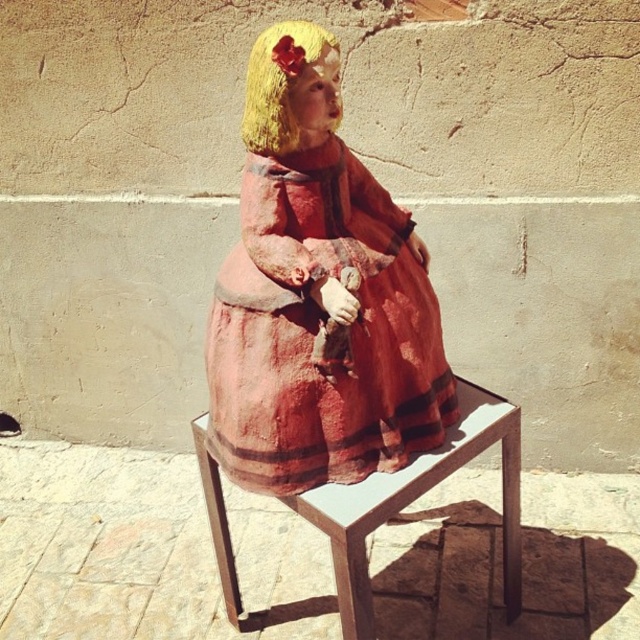
Can you confirm if matte red fabric dress at center is bigger than wooden stool at center?

No.

Who is taller, matte red fabric dress at center or wooden stool at center?

matte red fabric dress at center

Is point (262, 240) closer to camera compared to point (292, 508)?

Yes.

At what (x,y) coordinates should I click in order to perform the action: click on matte red fabric dress at center. Please return your answer as a coordinate pair (x, y). The height and width of the screenshot is (640, 640). Looking at the image, I should click on (316, 330).

Does matte clay doll at center lie in front of matte red fabric dress at center?

Yes, it is in front of matte red fabric dress at center.

Identify the location of matte clay doll at center. The width and height of the screenshot is (640, 640). (332, 337).

Is matte clay doll at center closer to the viewer compared to wooden stool at center?

Yes, it is in front of wooden stool at center.

Is point (337, 145) behind point (324, 520)?

Yes, it is.

Where is `matte clay doll at center`? matte clay doll at center is located at coordinates (332, 337).